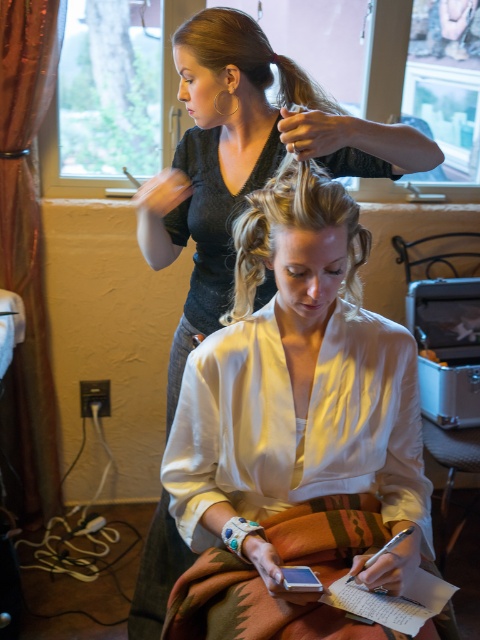
You are a photographer setting up for a photoshoot and notice the camouflage fabric robe at center and the blonde hair at upper center. Which object is closer to the camera based on their positions?

The camouflage fabric robe at center is closer to the camera because the blonde hair at upper center is behind it.